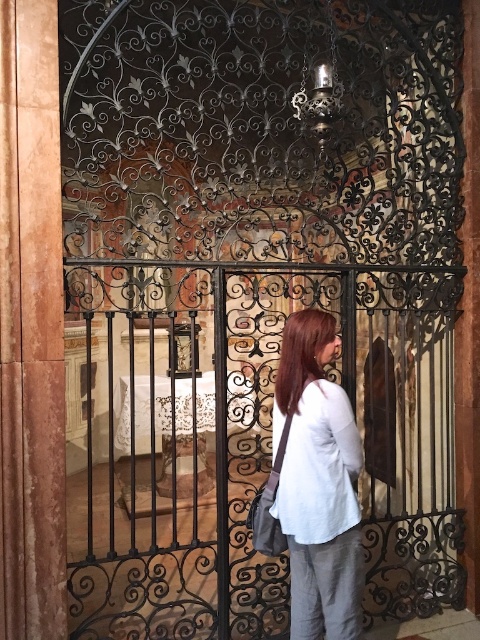
Question: Which object is the closest to the brown wood pillar at left?

Choices:
 (A) white linen shirt at center
 (B) light gray cotton shirt at center
 (C) shiny brown hair at center

Answer: (C)

Question: From the image, what is the correct spatial relationship of brown wood pillar at left in relation to shiny brown hair at center?

Choices:
 (A) right
 (B) left

Answer: (B)

Question: Can you confirm if light gray cotton shirt at center is positioned above white linen shirt at center?

Choices:
 (A) no
 (B) yes

Answer: (A)

Question: Which of the following is the farthest from the observer?

Choices:
 (A) white linen shirt at center
 (B) light gray cotton shirt at center
 (C) shiny brown hair at center

Answer: (C)

Question: Estimate the real-world distances between objects in this image. Which object is farther from the shiny brown hair at center?

Choices:
 (A) light gray cotton shirt at center
 (B) brown wood pillar at left

Answer: (B)

Question: Does white linen shirt at center appear on the left side of shiny brown hair at center?

Choices:
 (A) yes
 (B) no

Answer: (B)